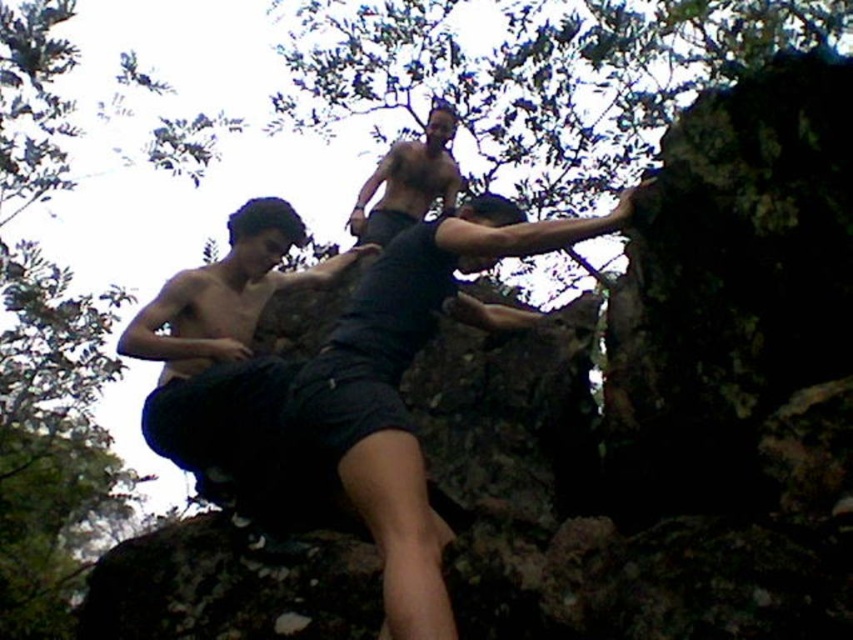
Question: Which point is farther from the camera taking this photo?

Choices:
 (A) (252, 499)
 (B) (543, 252)

Answer: (A)

Question: Is dark gray shorts at center smaller than dark matte shorts at left?

Choices:
 (A) no
 (B) yes

Answer: (A)

Question: Is dark matte shorts at left positioned before shiny black shorts at upper center?

Choices:
 (A) yes
 (B) no

Answer: (A)

Question: Among these points, which one is farthest from the camera?

Choices:
 (A) (402, 452)
 (B) (448, 186)
 (C) (364, 244)

Answer: (B)

Question: Is dark gray shorts at center to the left of dark matte shorts at left from the viewer's perspective?

Choices:
 (A) yes
 (B) no

Answer: (B)

Question: Which object appears farthest from the camera in this image?

Choices:
 (A) shiny black shorts at upper center
 (B) dark matte shorts at left

Answer: (A)